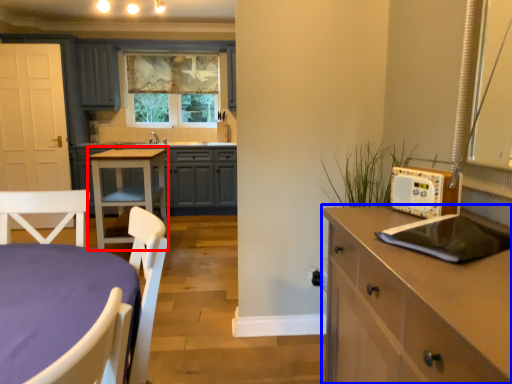
Question: Which of the following is the closest to the observer, table (highlighted by a red box) or cabinetry (highlighted by a blue box)?

Choices:
 (A) table
 (B) cabinetry

Answer: (B)